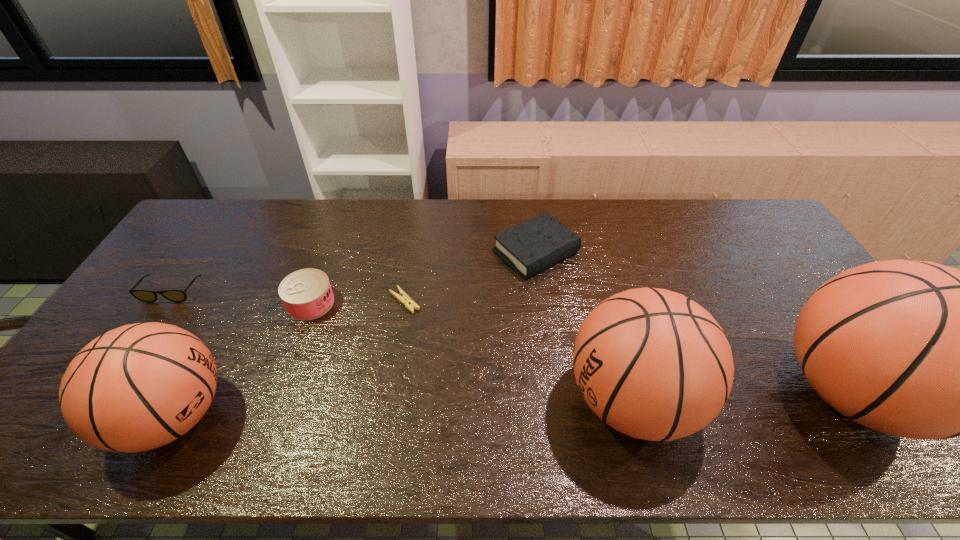
Locate which object is the sixth closest to the shortest basketball. Please provide its 2D coordinates. Your answer should be formatted as a tuple, i.e. [(x, y)], where the tuple contains the x and y coordinates of a point satisfying the conditions above.

[(916, 349)]

You are a GUI agent. You are given a task and a screenshot of the screen. Output one action in this format:
    pyautogui.click(x=<x>, y=<y>)
    Task: Click on the second closest basketball to the shortest basketball
    The width and height of the screenshot is (960, 540).
    Given the screenshot: What is the action you would take?
    pyautogui.click(x=916, y=349)

Point out which basketball is positioned as the nearest to the Bible. Please provide its 2D coordinates. Your answer should be formatted as a tuple, i.e. [(x, y)], where the tuple contains the x and y coordinates of a point satisfying the conditions above.

[(651, 363)]

Find the location of a particular element. free space in the image that satisfies the following two spatial constraints: 1. on the back side of the fourth object from left to right; 2. on the right side of the Bible is located at coordinates (413, 252).